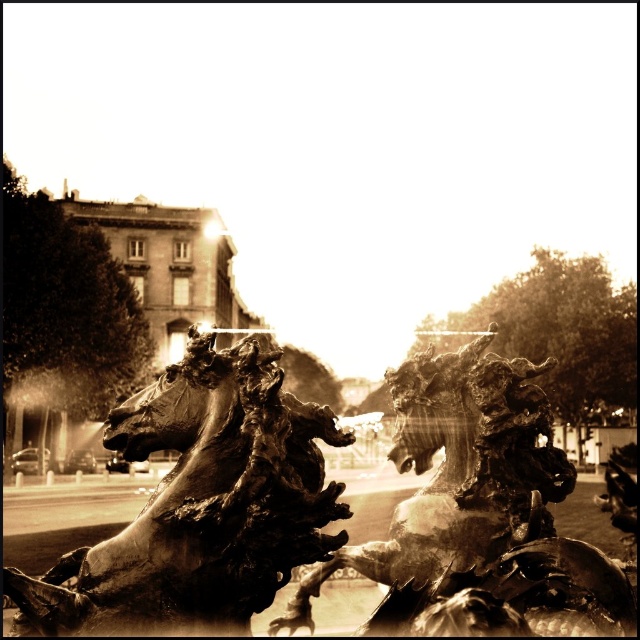
You are an art restorer assessing the space between two bronze statues in the image. The bronze horse at center and the bronze dragon at center are both positioned in the foreground. Which statue has a greater width, requiring more space for restoration work?

The bronze horse at center has a greater width than the bronze dragon at center, so it requires more space for restoration work.

You are an art conservator examining the vintage scene. You need to determine which of the two central statues, the bronze horse at center or the bronze dragon at center, requires immediate restoration due to its height. Which statue is taller?

The bronze horse at center is taller than the bronze dragon at center, so it requires immediate restoration due to its height.